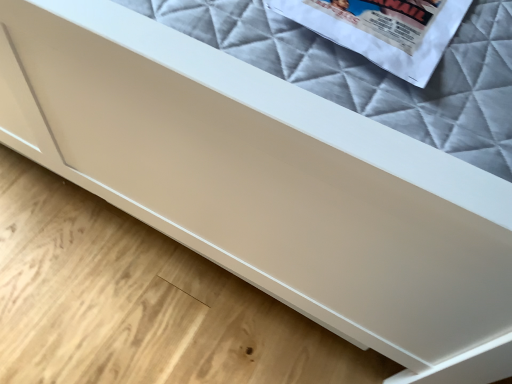
Find the location of a particular element. The image size is (512, 384). white paper magazine at upper center is located at coordinates (383, 29).

What do you see at coordinates (383, 29) in the screenshot? I see `white paper magazine at upper center` at bounding box center [383, 29].

The image size is (512, 384). Identify the location of white paper magazine at upper center. (383, 29).